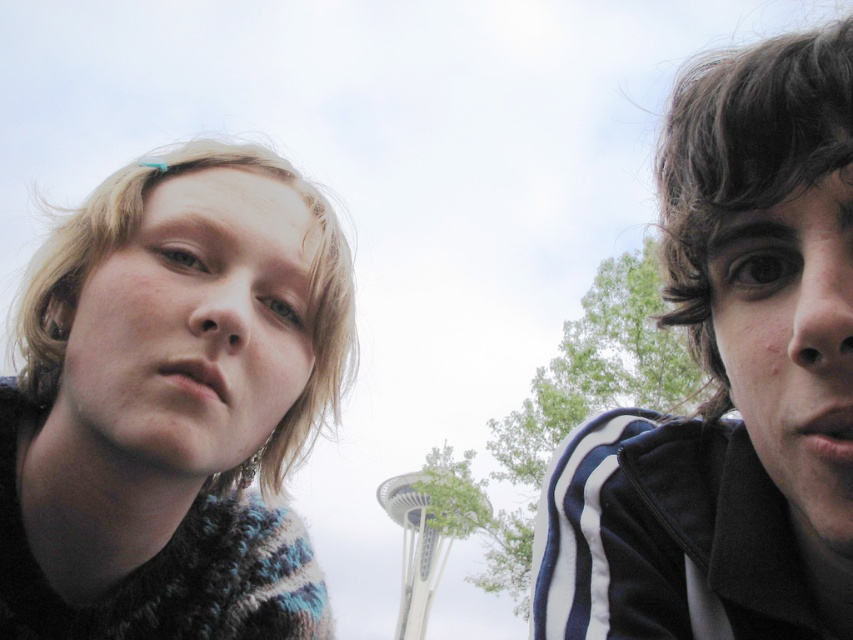
Who is taller, dark brown hair at upper right or knitted sweater at left?

Standing taller between the two is knitted sweater at left.

Who is more forward, (799, 349) or (234, 291)?

Point (799, 349) is more forward.

Is point (593, 624) less distant than point (90, 365)?

That is True.

Identify the location of dark brown hair at upper right. (729, 380).